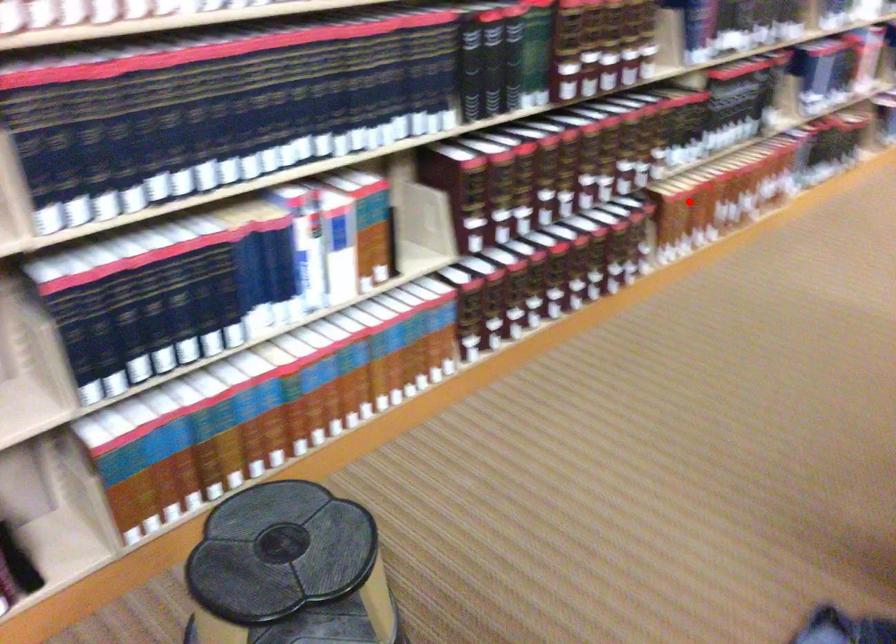
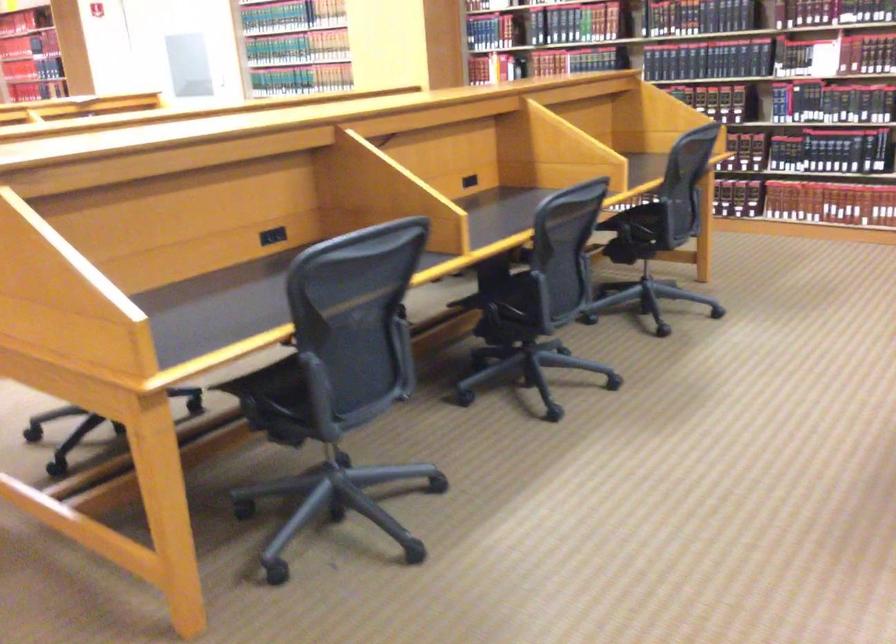
Question: I am providing you with two images of the same scene from different viewpoints. A red point is shown in image1. For the corresponding object point in image2, is it positioned nearer or farther from the camera?

Choices:
 (A) Nearer
 (B) Farther

Answer: (B)